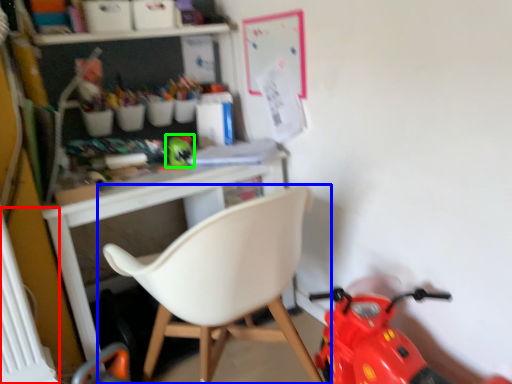
Question: Which object is the closest to the radiator (highlighted by a red box)? Choose among these: chair (highlighted by a blue box) or toy (highlighted by a green box).

Choices:
 (A) chair
 (B) toy

Answer: (A)